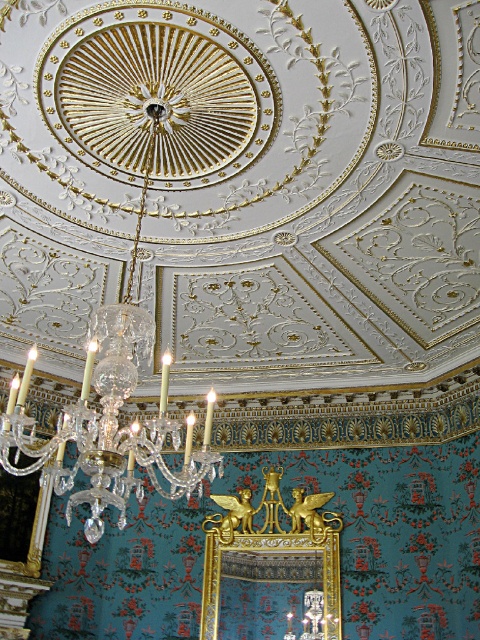
Question: Is crystalcandlestick chandelier at center wider than gold metallic picture frame at center?

Choices:
 (A) yes
 (B) no

Answer: (B)

Question: Which point appears farthest from the camera in this image?

Choices:
 (A) (271, 477)
 (B) (74, 438)

Answer: (A)

Question: Is crystalcandlestick chandelier at center closer to the viewer compared to gold metallic picture frame at center?

Choices:
 (A) no
 (B) yes

Answer: (B)

Question: Which of the following is the farthest from the observer?

Choices:
 (A) gold metallic picture frame at center
 (B) crystalcandlestick chandelier at center

Answer: (A)

Question: Does crystalcandlestick chandelier at center appear on the left side of gold metallic picture frame at center?

Choices:
 (A) no
 (B) yes

Answer: (B)